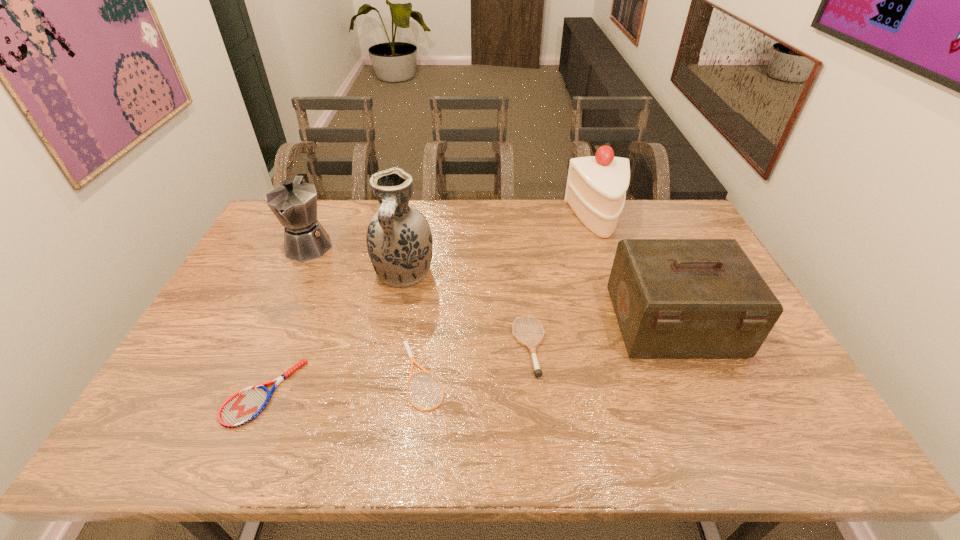
You are a GUI agent. You are given a task and a screenshot of the screen. Output one action in this format:
    pyautogui.click(x=<x>, y=<y>)
    Task: Click on the empty location between the tallest tennis racket and the tallest object
    
    Given the screenshot: What is the action you would take?
    [467, 310]

Locate an element on the screen. This screenshot has width=960, height=540. vacant point located between the shortest tennis racket and the coffeepot is located at coordinates (367, 310).

This screenshot has height=540, width=960. I want to click on vacant area that lies between the coffeepot and the first-aid kit, so tap(492, 284).

In order to click on vacant region between the coffeepot and the cake in this screenshot , I will do `click(454, 232)`.

The image size is (960, 540). I want to click on vacant area that lies between the tallest tennis racket and the second tennis racket from right to left, so click(477, 361).

This screenshot has height=540, width=960. What are the coordinates of `unoccupied position between the vase and the rightmost tennis racket` in the screenshot? It's located at (467, 310).

Locate an element on the screen. This screenshot has height=540, width=960. free space between the rightmost tennis racket and the coffeepot is located at coordinates (420, 295).

What are the coordinates of `object that stands as the second closest to the shortest object` in the screenshot? It's located at [x=399, y=241].

Identify which object is the third nearest to the third object from right to left. Please provide its 2D coordinates. Your answer should be formatted as a tuple, i.e. [(x, y)], where the tuple contains the x and y coordinates of a point satisfying the conditions above.

[(399, 241)]

I want to click on tennis racket that can be found as the second closest to the tallest object, so click(x=538, y=372).